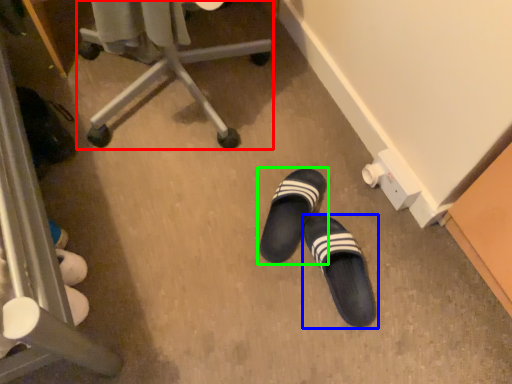
Question: Which object is positioned closest to furniture (highlighted by a red box)? Select from footwear (highlighted by a blue box) and footwear (highlighted by a green box).

Choices:
 (A) footwear
 (B) footwear

Answer: (B)